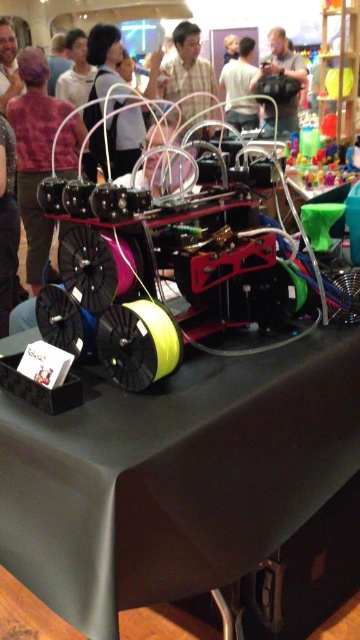
Question: Is plaid shirt at center further to the viewer compared to white matte shirt at upper center?

Choices:
 (A) no
 (B) yes

Answer: (A)

Question: Is light brown leather jacket at upper center to the right of white matte shirt at upper center from the viewer's perspective?

Choices:
 (A) yes
 (B) no

Answer: (A)

Question: Estimate the real-world distances between objects in this image. Which object is farther from the light brown leather jacket at upper center?

Choices:
 (A) white matte shirt at upper center
 (B) black matte table at center
 (C) matte purple shirt at upper left

Answer: (B)

Question: Which point is closer to the camera taking this photo?

Choices:
 (A) (185, 84)
 (B) (244, 49)
 (C) (290, 129)
 (D) (12, 51)

Answer: (C)

Question: Among these points, which one is farthest from the camera?

Choices:
 (A) (177, 80)
 (B) (6, 333)
 (C) (254, 104)
 (D) (290, 56)

Answer: (C)

Question: Does matte purple shirt at upper left have a smaller size compared to light brown hair at upper left?

Choices:
 (A) no
 (B) yes

Answer: (A)